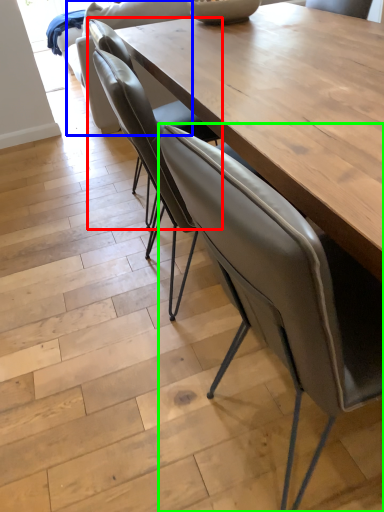
Question: Based on their relative distances, which object is farther from chair (highlighted by a red box)? Choose from armchair (highlighted by a blue box) and chair (highlighted by a green box).

Choices:
 (A) armchair
 (B) chair

Answer: (A)